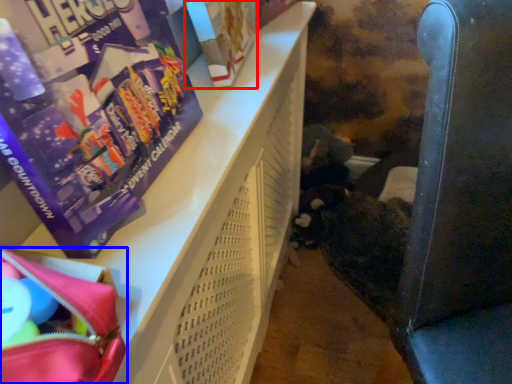
Question: Which object appears farthest to the camera in this image, paperback book (highlighted by a red box) or bag (highlighted by a blue box)?

Choices:
 (A) paperback book
 (B) bag

Answer: (A)